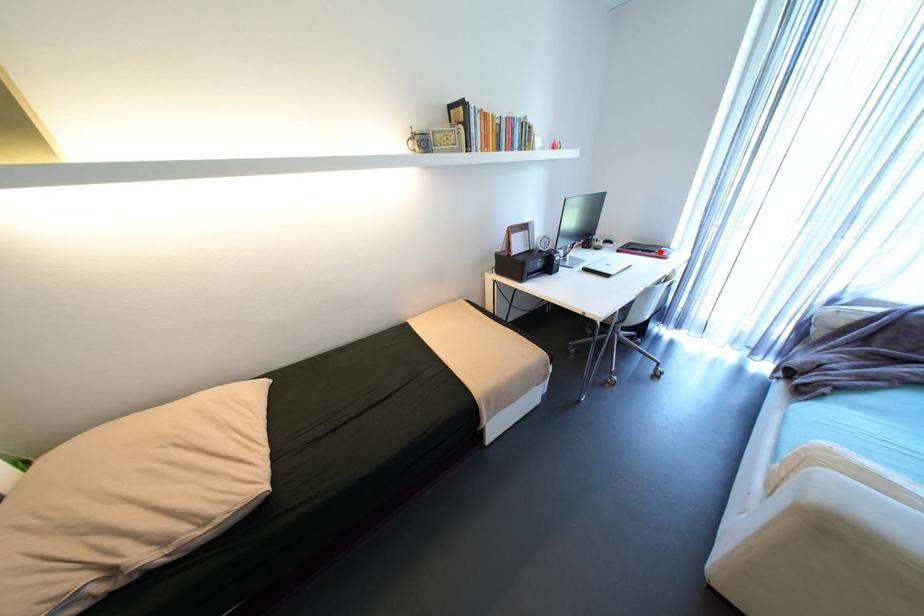
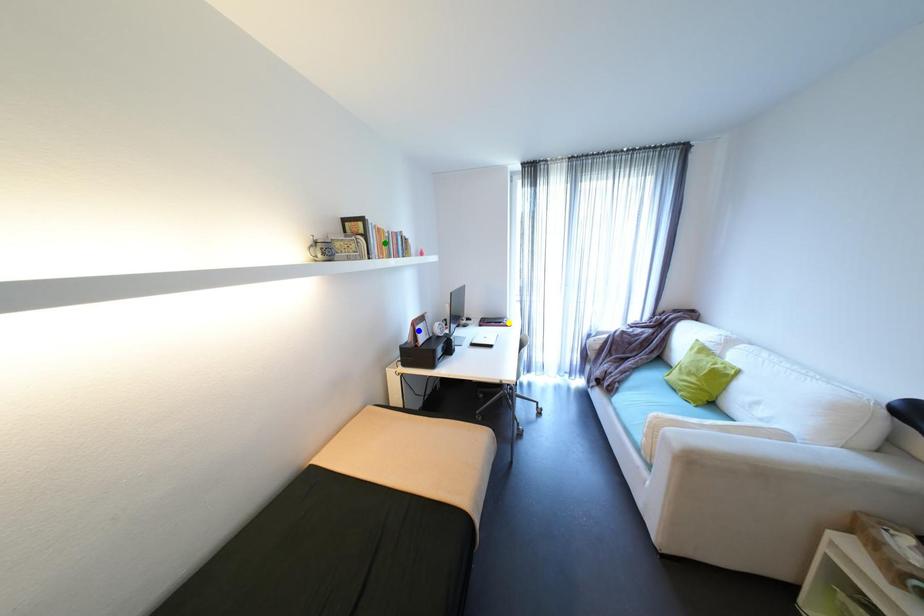
Question: I am providing you with two images of the same scene from different viewpoints. A red point is marked on the first image. You are given multiple points on the second image. Which point in image 2 represents the same 3d spot as the red point in image 1?

Choices:
 (A) green point
 (B) yellow point
 (C) blue point

Answer: (B)